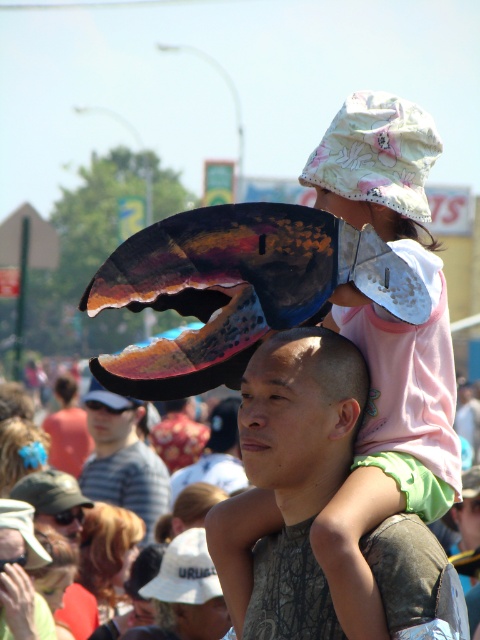
Question: Based on their relative distances, which object is nearer to the smooth skin head at center?

Choices:
 (A) floral cotton bucket hat at upper center
 (B) striped cotton shirt at center

Answer: (A)

Question: Can you confirm if floral cotton bucket hat at upper center is positioned below striped cotton shirt at center?

Choices:
 (A) yes
 (B) no

Answer: (B)

Question: From the image, what is the correct spatial relationship of matte black shirt at center in relation to white matte visor at upper left?

Choices:
 (A) right
 (B) left

Answer: (A)

Question: Can you confirm if matte black shirt at center is positioned above striped cotton shirt at center?

Choices:
 (A) no
 (B) yes

Answer: (B)

Question: Which object appears farthest from the camera in this image?

Choices:
 (A) smooth skin head at center
 (B) striped cotton shirt at center
 (C) floral cotton bucket hat at upper center

Answer: (B)

Question: Which object is closer to the camera taking this photo?

Choices:
 (A) striped cotton shirt at center
 (B) white matte visor at upper left

Answer: (A)